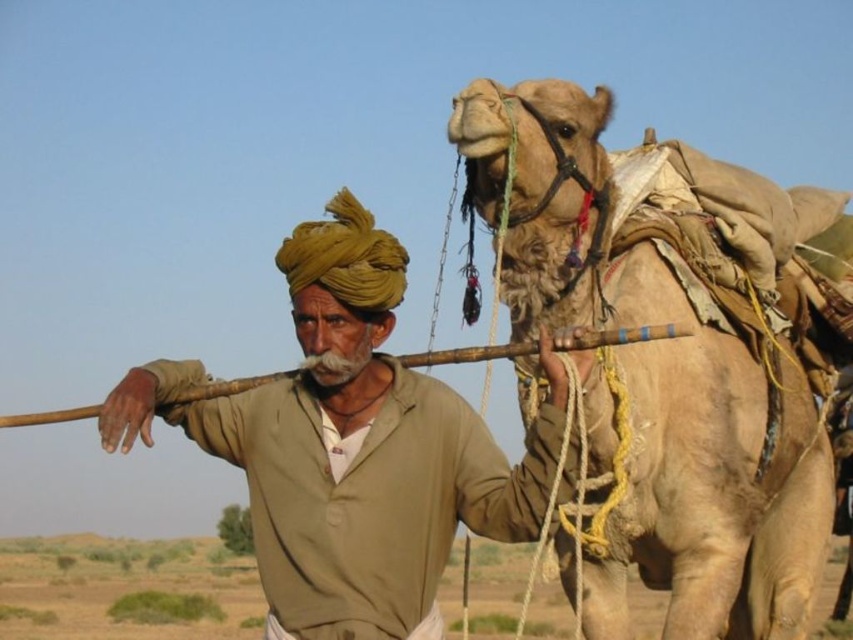
Question: Which object is closer to the camera taking this photo?

Choices:
 (A) fuzzy beige camel at right
 (B) khaki cotton shirt at center

Answer: (B)

Question: From the image, what is the correct spatial relationship of fuzzy beige camel at right in relation to khaki cotton shirt at center?

Choices:
 (A) above
 (B) below

Answer: (A)

Question: Is fuzzy beige camel at right to the right of khaki cotton shirt at center from the viewer's perspective?

Choices:
 (A) yes
 (B) no

Answer: (A)

Question: Which object is closer to the camera taking this photo?

Choices:
 (A) khaki cotton shirt at center
 (B) fuzzy beige camel at right

Answer: (A)

Question: Does fuzzy beige camel at right have a larger size compared to khaki cotton shirt at center?

Choices:
 (A) no
 (B) yes

Answer: (B)